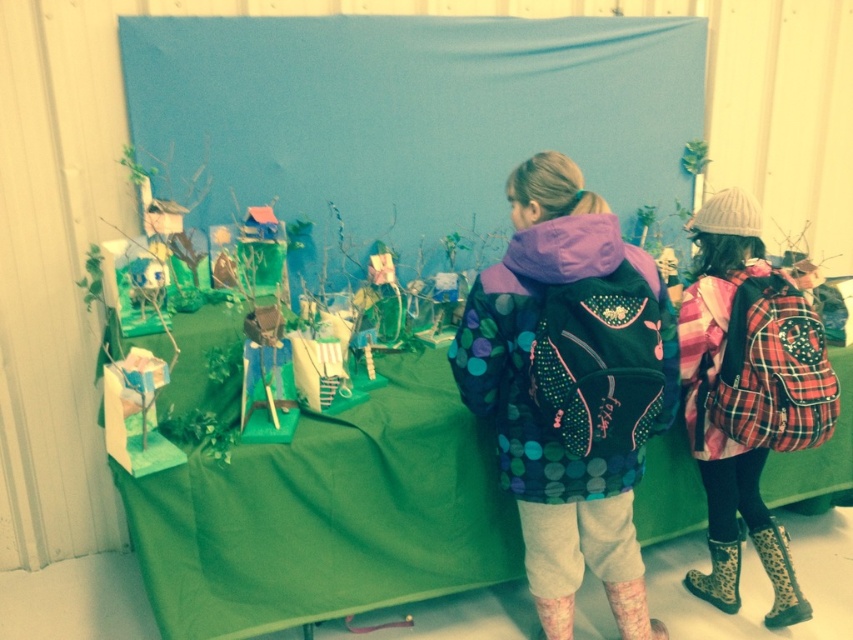
Question: Which is nearer to the green fabric table at center?

Choices:
 (A) blue fabric backdrop at center
 (B) leopard print fabric boot at lower right
 (C) pink textured boot at lower right

Answer: (C)

Question: Observing the image, what is the correct spatial positioning of blue fabric backdrop at center in reference to pink textured boot at lower right?

Choices:
 (A) left
 (B) right

Answer: (A)

Question: Which object is positioned closest to the polka dot fabric jacket at center?

Choices:
 (A) plaid fabric backpack at right
 (B) green fabric table at center
 (C) blue fabric backdrop at center

Answer: (B)

Question: Is plaid fabric backpack at right behind leopard print fabric boot at lower right?

Choices:
 (A) no
 (B) yes

Answer: (A)

Question: Is the position of plaid fabric backpack at right more distant than that of pink textured boot at lower right?

Choices:
 (A) yes
 (B) no

Answer: (B)

Question: Which is nearer to the blue fabric backdrop at center?

Choices:
 (A) pink textured boot at lower right
 (B) plaid fabric backpack at right

Answer: (B)